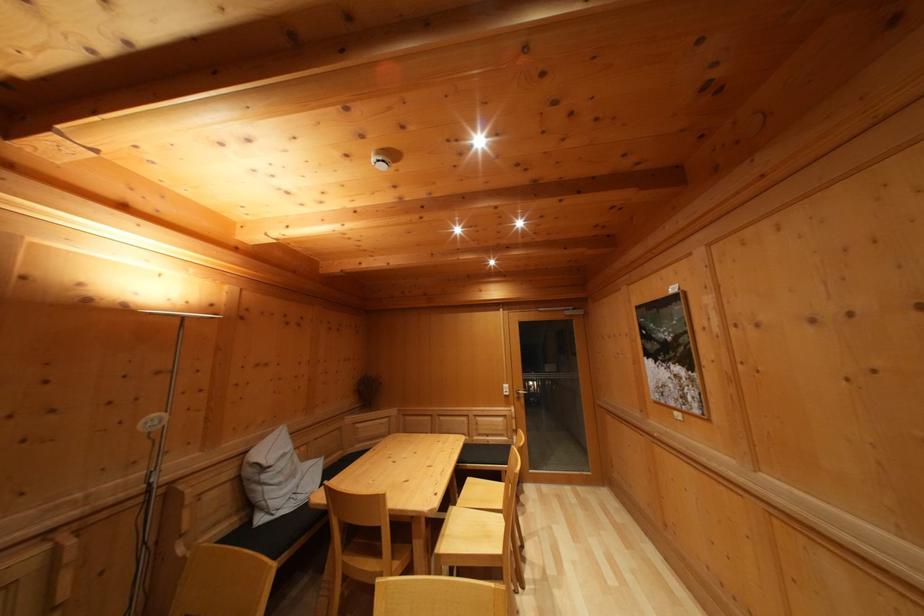
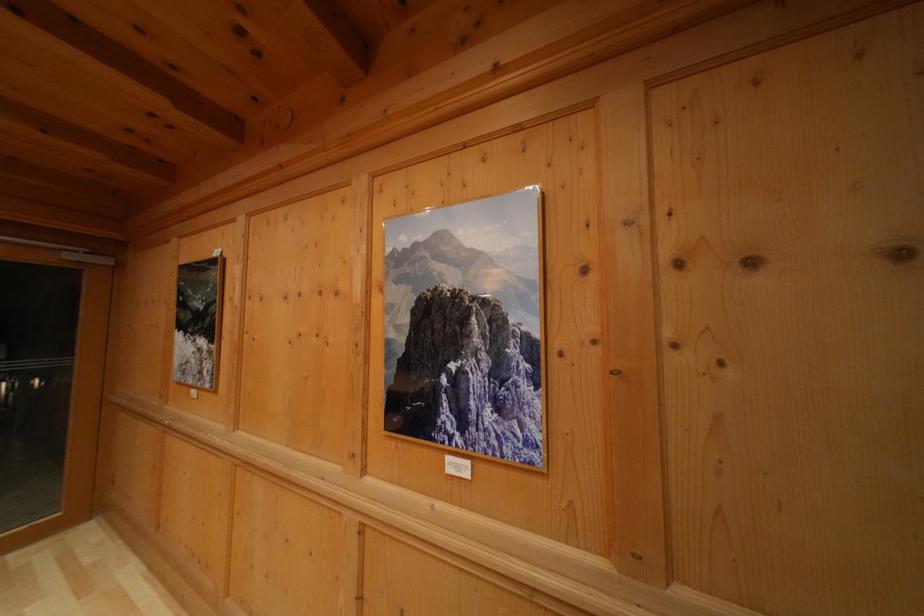
Question: Based on the continuous images, in which direction is the camera rotating? Reply with the corresponding letter.

Choices:
 (A) Left
 (B) Right
 (C) Up
 (D) Down

Answer: (B)